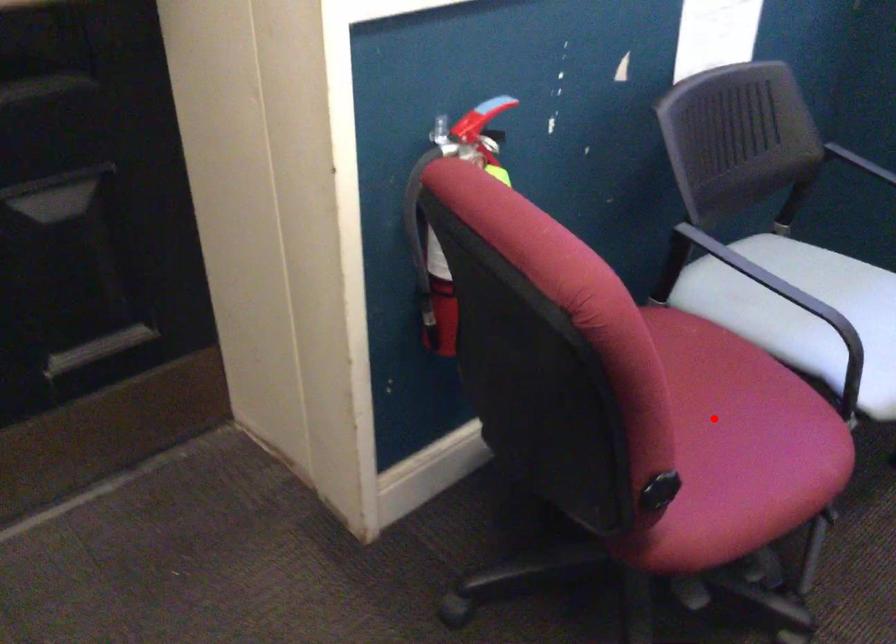
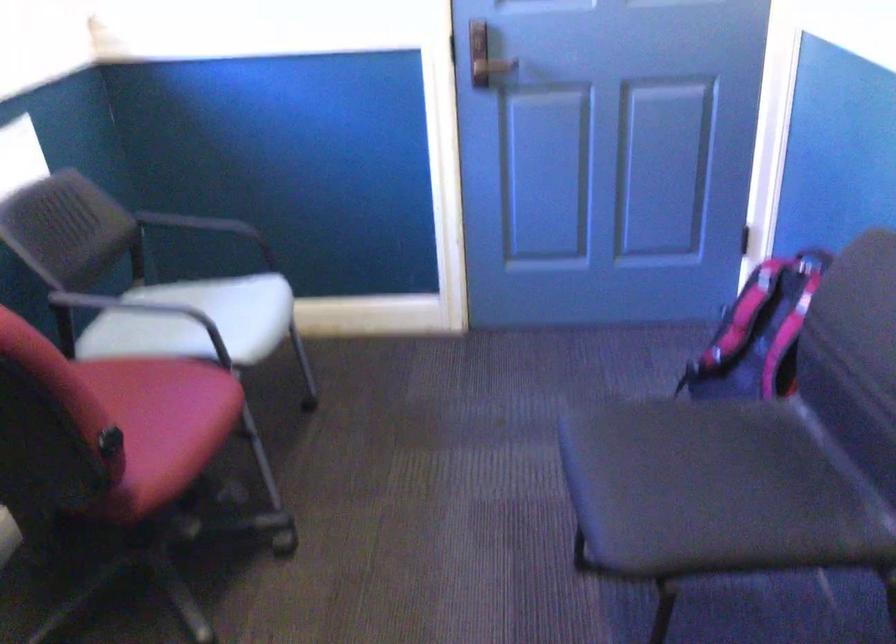
Locate, in the second image, the point that corresponds to the highlighted location in the first image.

(149, 402)